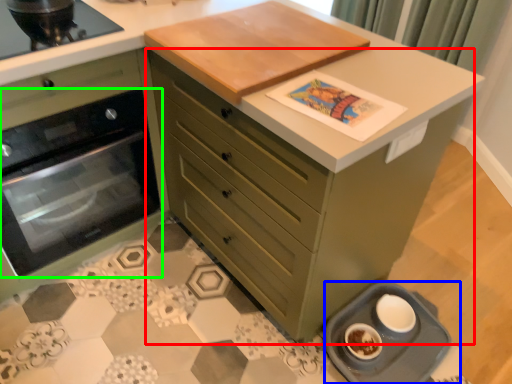
Question: Based on their relative distances, which object is nearer to chest of drawers (highlighted by a red box)? Choose from appliance (highlighted by a blue box) and kitchen appliance (highlighted by a green box).

Choices:
 (A) appliance
 (B) kitchen appliance

Answer: (A)